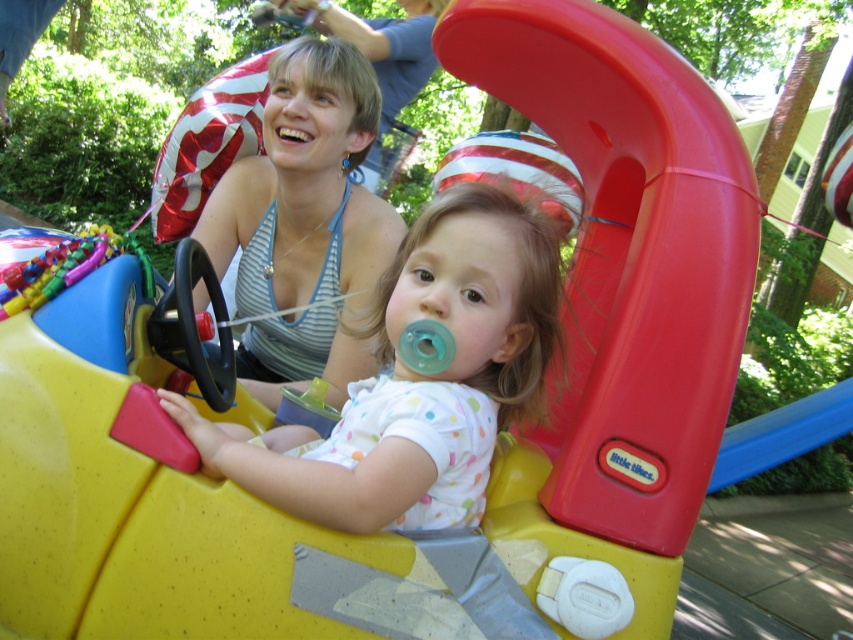
Question: Which point is closer to the camera taking this photo?

Choices:
 (A) (393, 269)
 (B) (241, 336)

Answer: (A)

Question: Which point is farther to the camera?

Choices:
 (A) white dotted fabric at center
 (B) matte blue tank top at upper center

Answer: (B)

Question: Can you confirm if white dotted fabric at center is positioned below matte blue tank top at upper center?

Choices:
 (A) no
 (B) yes

Answer: (B)

Question: Is white dotted fabric at center in front of matte blue tank top at upper center?

Choices:
 (A) yes
 (B) no

Answer: (A)

Question: Is white dotted fabric at center closer to the viewer compared to matte blue tank top at upper center?

Choices:
 (A) yes
 (B) no

Answer: (A)